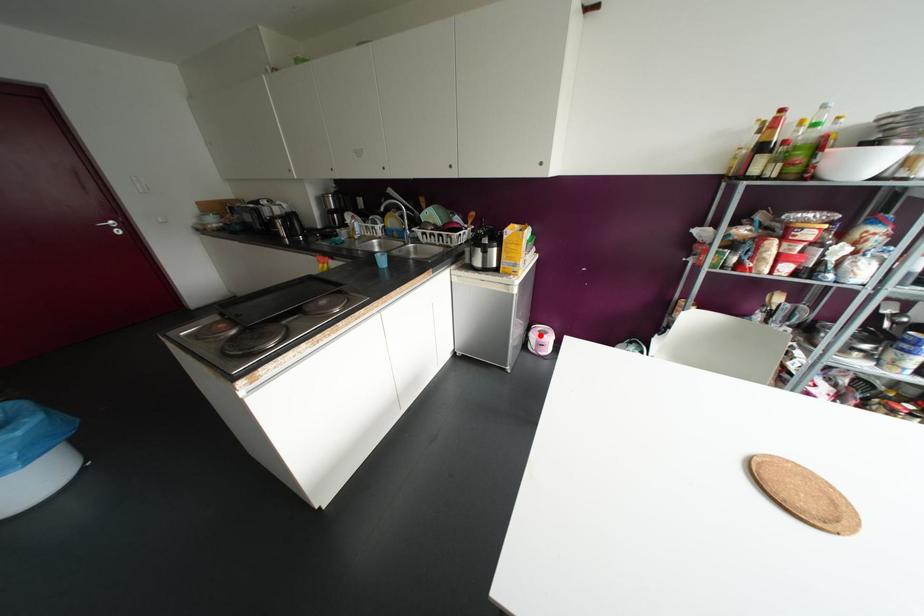
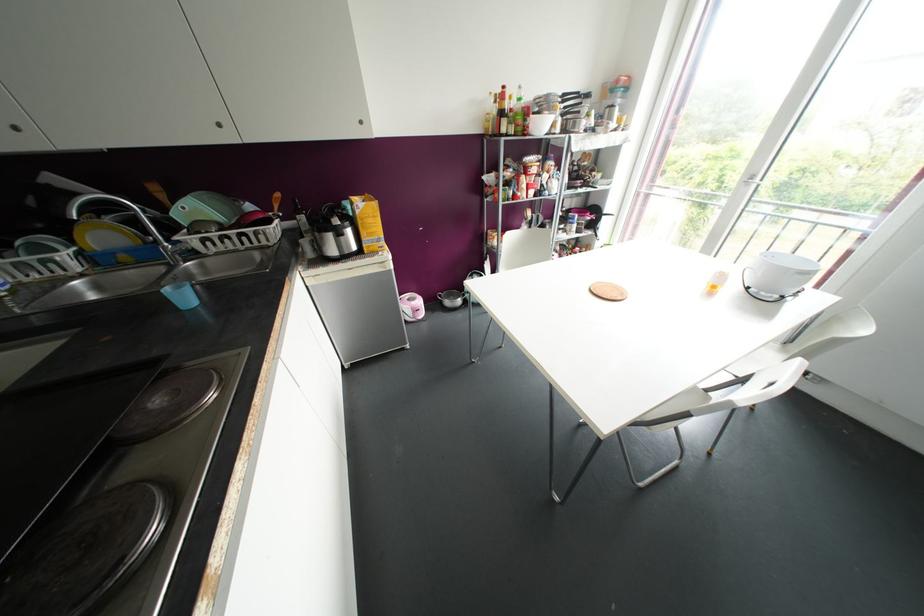
Locate, in the second image, the point that corresponds to the highlighted location in the first image.

(412, 302)